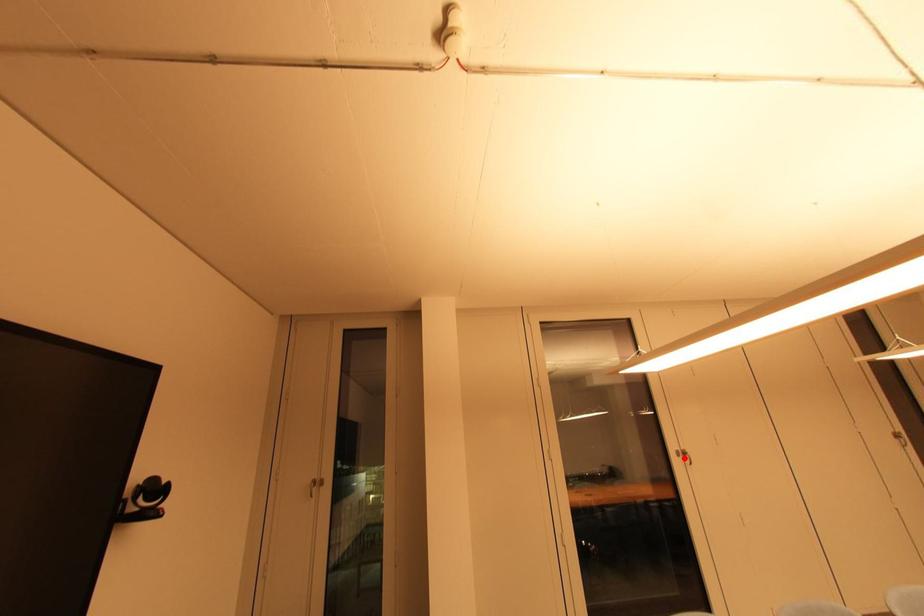
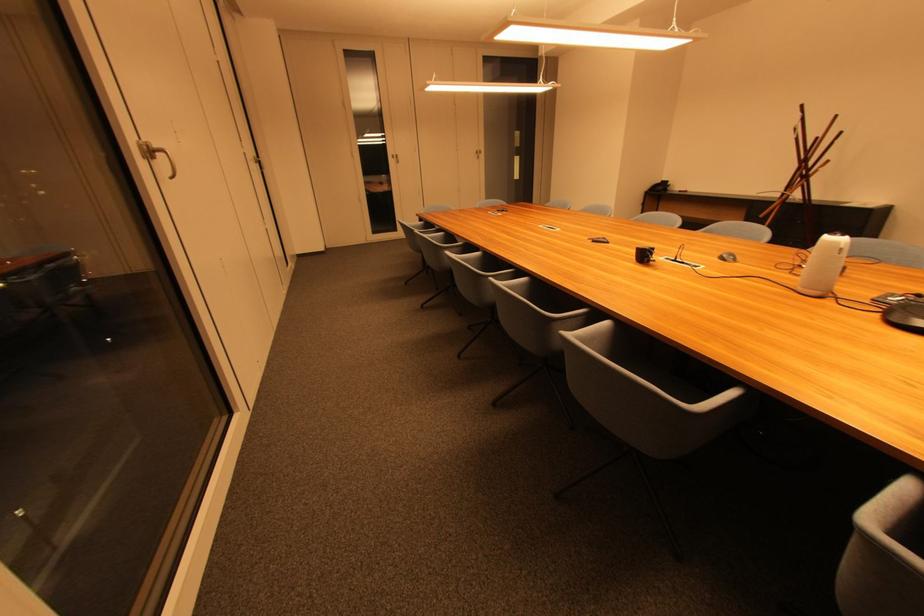
Locate, in the second image, the point that corresponds to the highlighted location in the first image.

(148, 159)